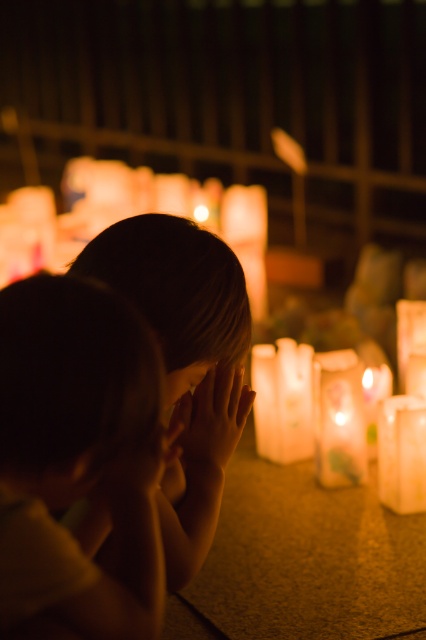
Question: Which of the following is the closest to the observer?

Choices:
 (A) (72, 486)
 (B) (187, 387)

Answer: (A)

Question: Is silky yellow shirt at lower left wider than smooth skin face at center?

Choices:
 (A) yes
 (B) no

Answer: (A)

Question: Is matte skin hand at center below smooth skin face at center?

Choices:
 (A) yes
 (B) no

Answer: (A)

Question: Can you confirm if silky yellow shirt at lower left is positioned below smooth skin face at center?

Choices:
 (A) no
 (B) yes

Answer: (B)

Question: Which point appears farthest from the camera in this image?

Choices:
 (A) (173, 372)
 (B) (83, 307)
 (C) (187, 426)

Answer: (C)

Question: Which point appears farthest from the camera in this image?

Choices:
 (A) (189, 433)
 (B) (181, 381)

Answer: (A)